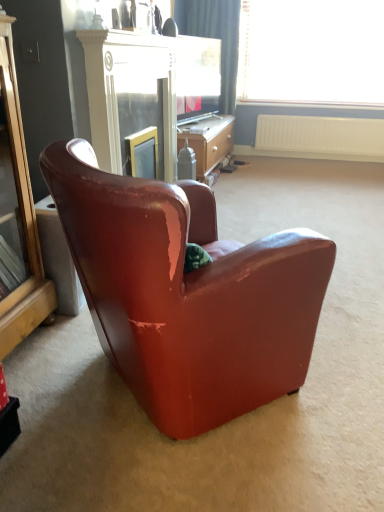
Question: From a real-world perspective, is matte black television at center over white plastic radiator at upper right?

Choices:
 (A) yes
 (B) no

Answer: (A)

Question: Is matte black television at center not close to white plastic radiator at upper right?

Choices:
 (A) no
 (B) yes

Answer: (B)

Question: Is matte black television at center not inside white plastic radiator at upper right?

Choices:
 (A) no
 (B) yes

Answer: (B)

Question: Is white plastic radiator at upper right completely or partially inside matte black television at center?

Choices:
 (A) no
 (B) yes

Answer: (A)

Question: From the image's perspective, is matte black television at center over white plastic radiator at upper right?

Choices:
 (A) no
 (B) yes

Answer: (B)

Question: From a real-world perspective, is matte black television at center positioned under white plastic radiator at upper right based on gravity?

Choices:
 (A) yes
 (B) no

Answer: (B)

Question: From the image's perspective, is transparent glass window at upper center on top of matte glass screen door at upper center?

Choices:
 (A) no
 (B) yes

Answer: (B)

Question: Can you confirm if transparent glass window at upper center is positioned to the left of matte glass screen door at upper center?

Choices:
 (A) no
 (B) yes

Answer: (A)

Question: Is transparent glass window at upper center at the right side of matte glass screen door at upper center?

Choices:
 (A) no
 (B) yes

Answer: (B)

Question: Is transparent glass window at upper center positioned behind matte glass screen door at upper center?

Choices:
 (A) yes
 (B) no

Answer: (A)

Question: Can you confirm if transparent glass window at upper center is thinner than matte glass screen door at upper center?

Choices:
 (A) yes
 (B) no

Answer: (B)

Question: Does transparent glass window at upper center have a smaller size compared to matte glass screen door at upper center?

Choices:
 (A) no
 (B) yes

Answer: (A)

Question: Is wooden desk at center touching gold mirrored cabinet at left?

Choices:
 (A) yes
 (B) no

Answer: (B)